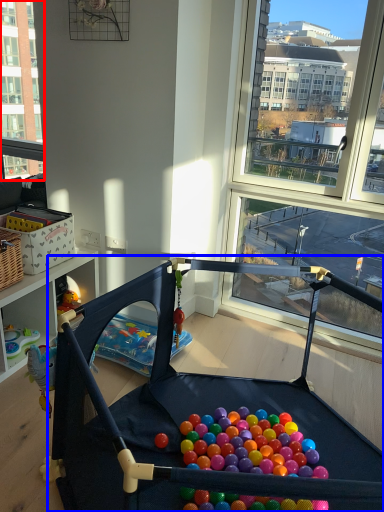
Question: Among these objects, which one is nearest to the camera, window (highlighted by a red box) or baby carriage (highlighted by a blue box)?

Choices:
 (A) window
 (B) baby carriage

Answer: (B)